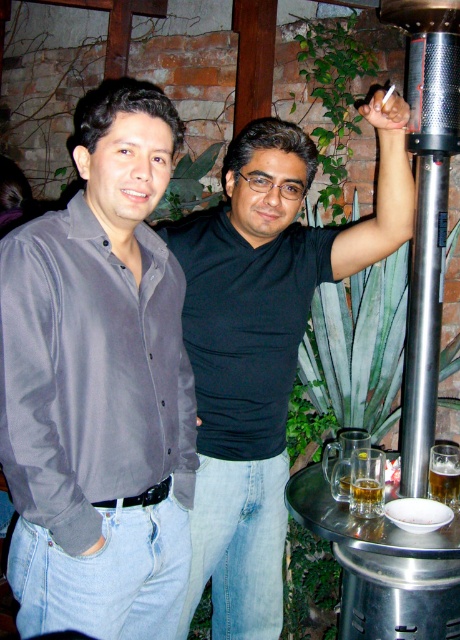
Question: Does matte gray shirt at left lie behind silver metallic pole at upper right?

Choices:
 (A) yes
 (B) no

Answer: (B)

Question: Which point is closer to the camera taking this photo?

Choices:
 (A) (195, 584)
 (B) (368, 500)
 (C) (429, 248)

Answer: (B)

Question: Is translucent glass beer at lower center closer to camera compared to translucent glass beer at lower right?

Choices:
 (A) yes
 (B) no

Answer: (A)

Question: Does black matte shirt at center have a smaller size compared to silver metallic pole at upper right?

Choices:
 (A) yes
 (B) no

Answer: (B)

Question: Which object appears closest to the camera in this image?

Choices:
 (A) silver metallic pole at upper right
 (B) black matte shirt at center
 (C) translucent glass beer at lower center
 (D) matte gray shirt at left

Answer: (D)

Question: Which is nearer to the silver metallic pole at upper right?

Choices:
 (A) translucent glass beer at lower center
 (B) matte gray shirt at left

Answer: (A)